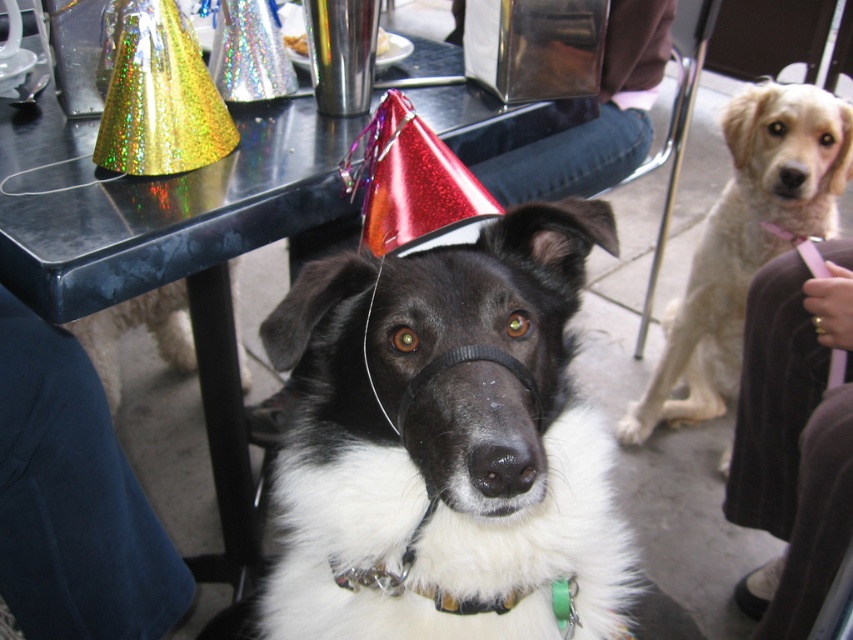
You are a photographer at a party and want to take a photo of the white fur dog at center and the metallic napkin holder at center. Which object is narrower in width?

The white fur dog at center is thinner than the metallic napkin holder at center, so the white fur dog at center is narrower in width.

You are a guest at the party and want to place a small gift on the table. The table has a metallic napkin holder at center and a light beige fur at right. Which object should you choose to place the gift next to if you want it to be near a larger object?

You should place the gift next to the light beige fur at right because it is larger than the metallic napkin holder at center.